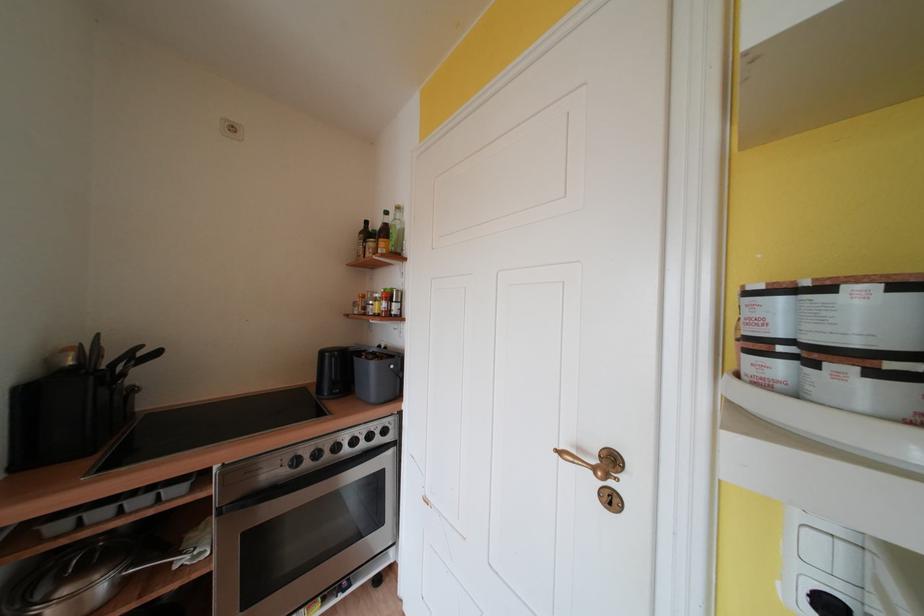
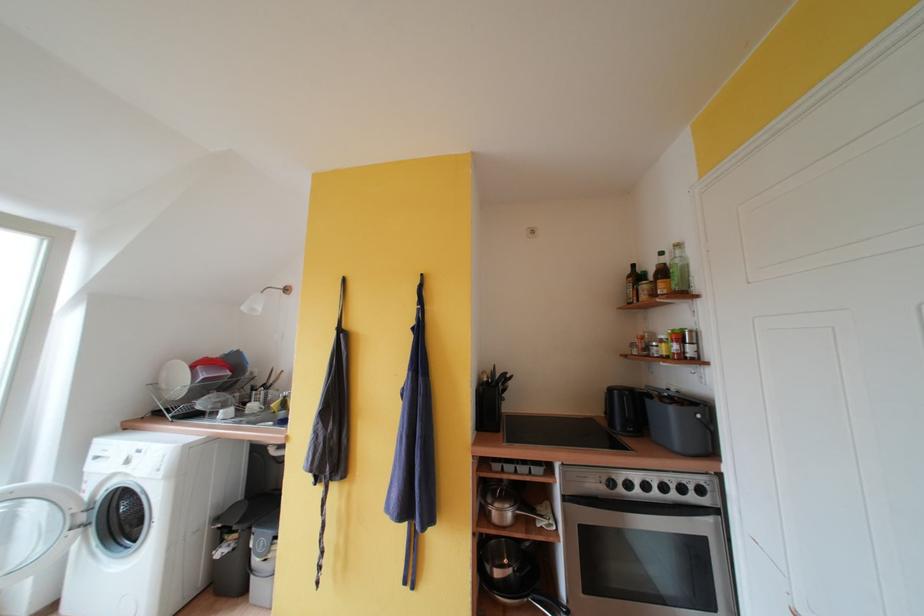
Locate, in the second image, the point that corresponds to the point at 395,223 in the first image.

(671, 262)